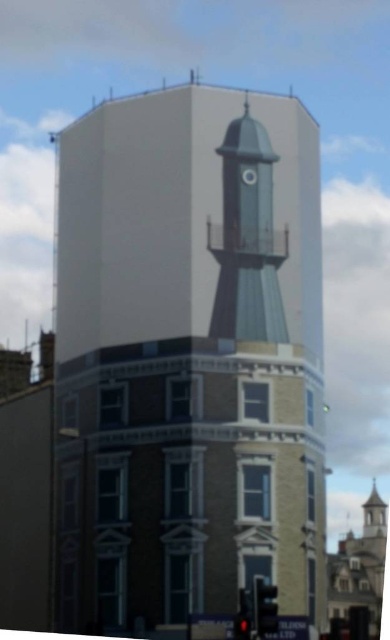
Question: Does smooth gray tower at center have a smaller size compared to metallic reflective sign at center?

Choices:
 (A) yes
 (B) no

Answer: (B)

Question: Which object is the closest to the smooth gray tower at center?

Choices:
 (A) red glass traffic light at lower center
 (B) metallic reflective sign at center
 (C) metallic gray clock at center

Answer: (C)

Question: Based on their relative distances, which object is farther from the metallic gray clock at center?

Choices:
 (A) matte black traffic light at lower center
 (B) red glass traffic light at lower center
 (C) smooth gray tower at center
 (D) metallic reflective sign at center

Answer: (B)

Question: Is smooth gray tower at center below metallic reflective sign at center?

Choices:
 (A) no
 (B) yes

Answer: (A)

Question: Which object is closer to the camera taking this photo?

Choices:
 (A) matte black traffic light at lower center
 (B) smooth gray tower at center
 (C) metallic gray water tower at center

Answer: (A)

Question: Is red glass traffic light at lower center closer to the viewer compared to metallic gray clock at center?

Choices:
 (A) no
 (B) yes

Answer: (B)